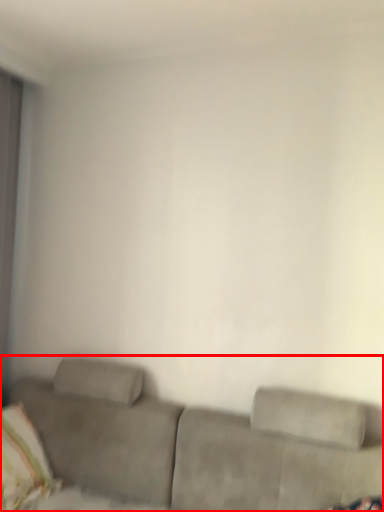
Question: In this image, where is studio couch (annotated by the red box) located relative to pillow?

Choices:
 (A) left
 (B) right

Answer: (B)